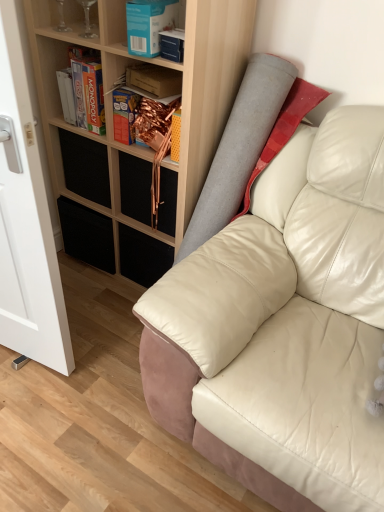
Identify the location of vacant space underneath white glossy glass door at left (from a real-world perspective). The height and width of the screenshot is (512, 384). (36, 360).